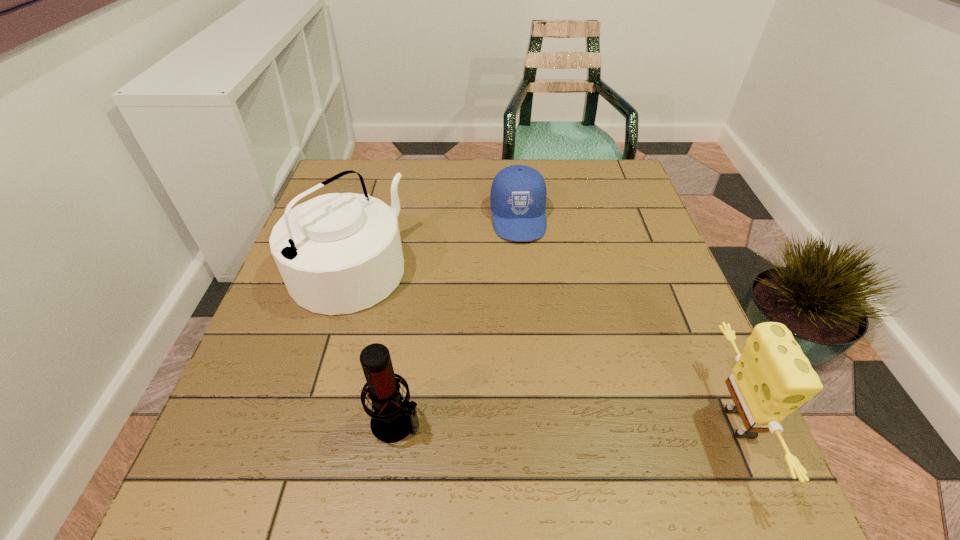
What are the coordinates of `microphone` in the screenshot? It's located at (392, 420).

The image size is (960, 540). Find the location of `the rightmost object`. the rightmost object is located at coordinates (772, 378).

Identify the location of kettle. This screenshot has height=540, width=960. (339, 253).

Find the location of `cap`. cap is located at coordinates (518, 194).

Find the location of a particular element. the shortest object is located at coordinates (518, 194).

Locate an element on the screen. Image resolution: width=960 pixels, height=540 pixels. vacant space situated 0.210m on the right of the microphone is located at coordinates (542, 422).

Where is `free space located 0.150m on the spout of the kettle`? This screenshot has width=960, height=540. free space located 0.150m on the spout of the kettle is located at coordinates (437, 330).

At what (x,y) coordinates should I click in order to perform the action: click on vacant area located 0.250m on the spout of the kettle. Please return your answer as a coordinate pair (x, y). The width and height of the screenshot is (960, 540). Looking at the image, I should click on (474, 355).

This screenshot has height=540, width=960. I want to click on vacant space located on the spout of the kettle, so click(479, 357).

The image size is (960, 540). Identify the location of vacant space positioned on the front-facing side of the cap. (538, 362).